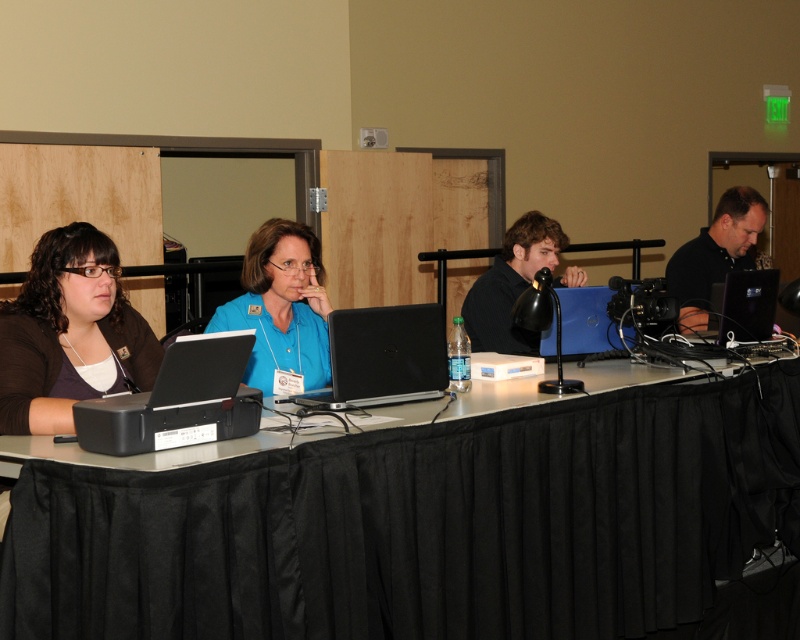
You are standing in front of the conference table. There is a point marked at coordinates (248, 342) on the table. If you want to place a 3 meter long banner across the table, will the banner fit from your current position to that point?

The point at (248, 342) is 2.56 meters away from you. Since the banner is 3 meters long, it will not fit from your current position to that point as the distance is shorter than the banner.

You are standing at the end of the table and want to place a new item on the table. If you want to place it closer to you, which point should you choose between point [696,307] and point [594,317]?

Point [696,307] is further to the viewer than point [594,317], so placing the item at point [696,307] would be closer to you.

From the picture: You are standing at point (750,243) and want to walk to point (230,378). Is the path directly in front of you?

Yes, the path directly in front of you leads to point (230,378) because it is positioned in front of point (750,243).